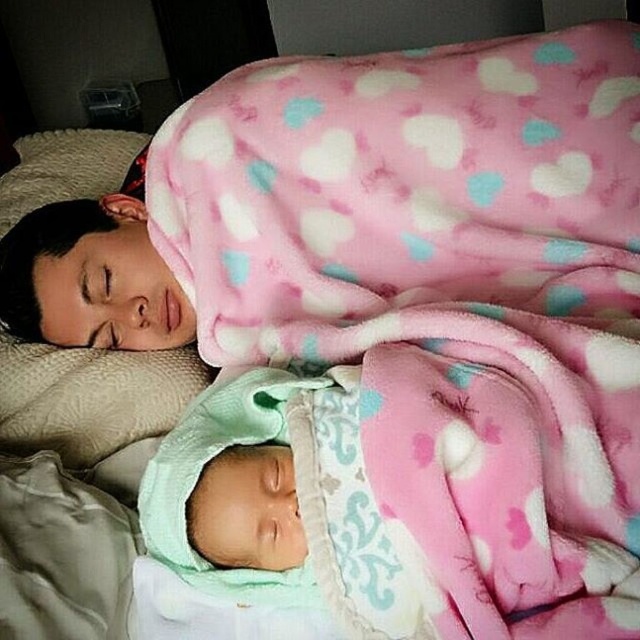
Locate an element on the screen. green fleece baby at lower center is located at coordinates (380, 509).

Between green fleece baby at lower center and beige quilted pillow at upper left, which one is positioned lower?

Positioned lower is green fleece baby at lower center.

You are a GUI agent. You are given a task and a screenshot of the screen. Output one action in this format:
    pyautogui.click(x=<x>, y=<y>)
    Task: Click on the green fleece baby at lower center
    Image resolution: width=640 pixels, height=640 pixels.
    Given the screenshot: What is the action you would take?
    pyautogui.click(x=380, y=509)